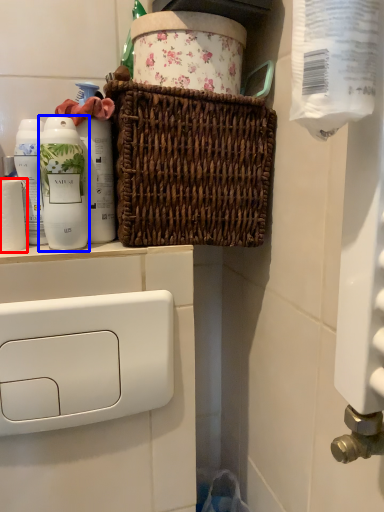
Question: Which of the following is the closest to the observer, toilet paper (highlighted by a red box) or bottle (highlighted by a blue box)?

Choices:
 (A) toilet paper
 (B) bottle

Answer: (B)